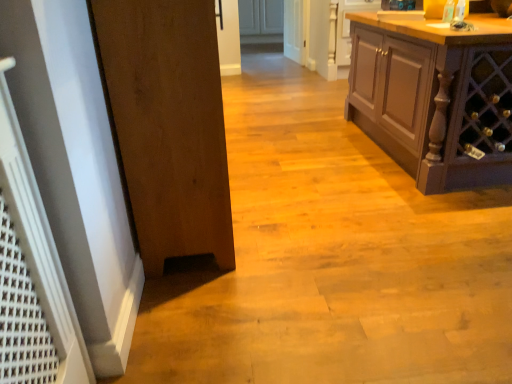
The height and width of the screenshot is (384, 512). I want to click on vacant space to the right of wooden door at left, so click(x=336, y=213).